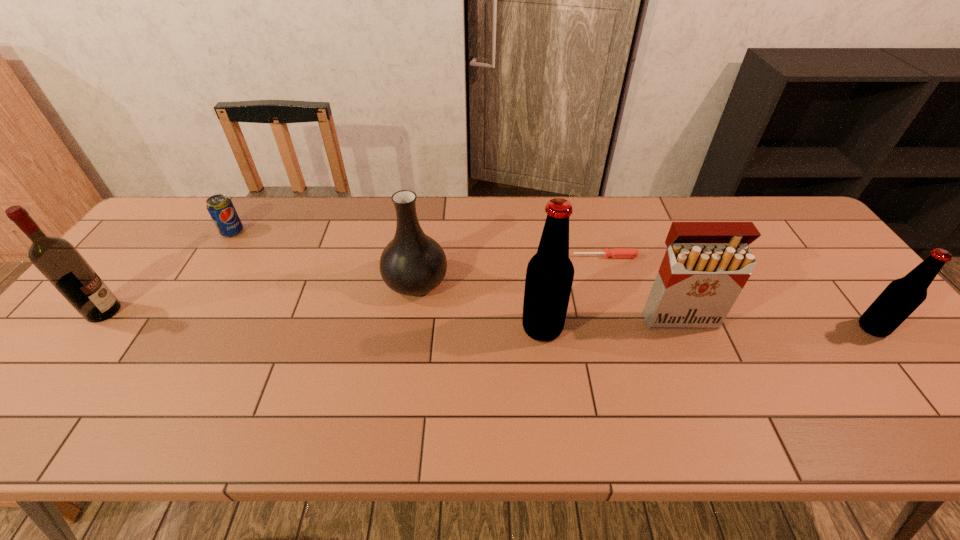
What are the coordinates of `vacant space situated 0.390m on the back of the taller beer bottle` in the screenshot? It's located at [528, 219].

Identify the location of vacant region located 0.090m on the back of the shorter beer bottle. (843, 292).

Find the location of `free spot located on the back of the soda`. free spot located on the back of the soda is located at coordinates (243, 215).

Identify the location of vacant area located 0.330m on the left of the vase. The height and width of the screenshot is (540, 960). (264, 281).

This screenshot has height=540, width=960. I want to click on vacant space situated on the front of the shortest object, so click(x=639, y=372).

I want to click on free space located 0.310m on the front and back of the alcohol, so click(240, 312).

The width and height of the screenshot is (960, 540). In order to click on vacant space positioned 0.100m with the lid open on the cigarette case in this screenshot , I will do `click(698, 364)`.

You are a GUI agent. You are given a task and a screenshot of the screen. Output one action in this format:
    pyautogui.click(x=<x>, y=<y>)
    Task: Click on the object located at the far edge
    The height and width of the screenshot is (540, 960).
    Given the screenshot: What is the action you would take?
    pos(221,209)

The width and height of the screenshot is (960, 540). I want to click on object at the left edge, so click(58, 260).

Identify the location of object that is at the right edge. (903, 296).